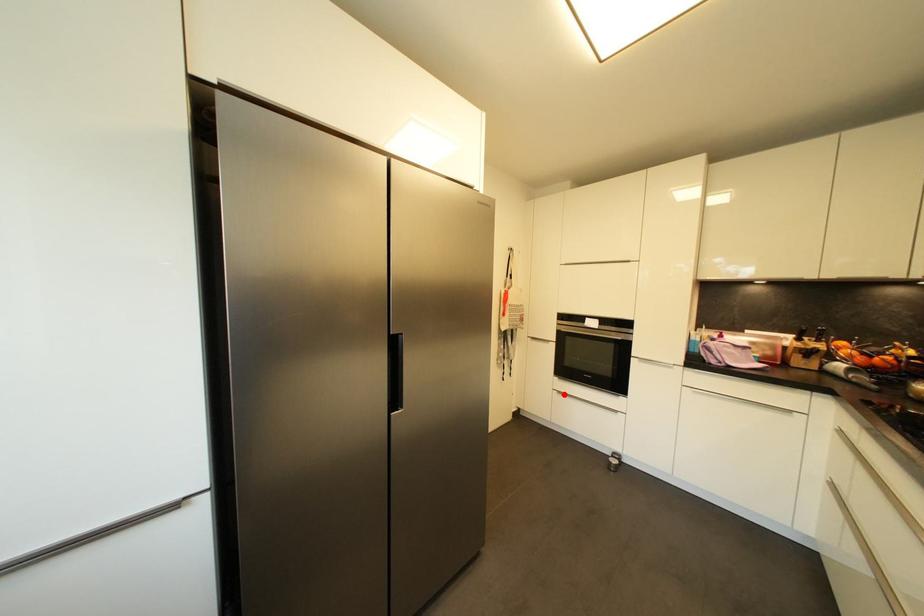
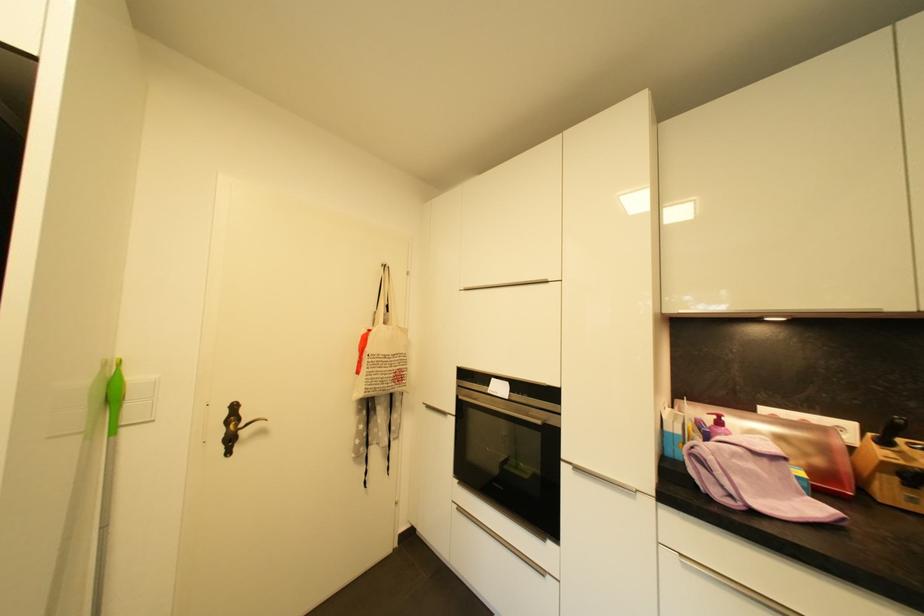
The point at the highlighted location is marked in the first image. Where is the corresponding point in the second image?

(465, 511)